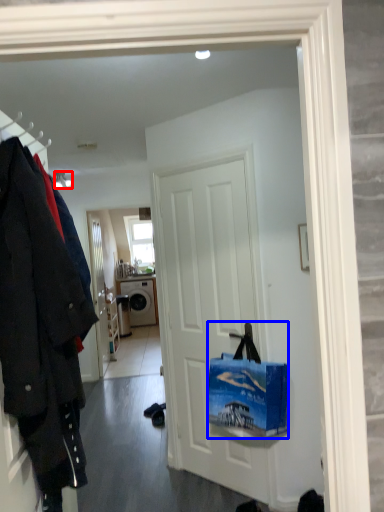
Question: Which point is closer to the camera, lamp (highlighted by a red box) or handbag (highlighted by a blue box)?

Choices:
 (A) lamp
 (B) handbag

Answer: (B)